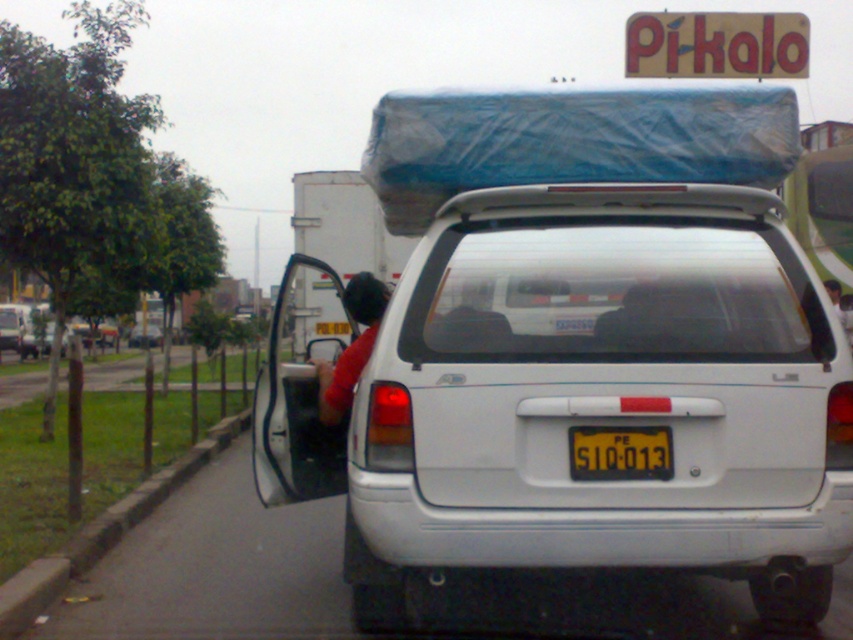
Does gray concrete curb at lower left have a lesser height compared to yellowtexturedlicense plate at center?

No, gray concrete curb at lower left is not shorter than yellowtexturedlicense plate at center.

Who is more distant from viewer, (50, 582) or (642, 428)?

Point (50, 582)

Locate an element on the screen. Image resolution: width=853 pixels, height=640 pixels. gray concrete curb at lower left is located at coordinates (103, 532).

Between gray concrete curb at lower left and white matte truck at center, which one has more height?

Standing taller between the two is white matte truck at center.

Does gray concrete curb at lower left have a smaller size compared to white matte truck at center?

Correct, gray concrete curb at lower left occupies less space than white matte truck at center.

The height and width of the screenshot is (640, 853). Identify the location of gray concrete curb at lower left. (103, 532).

Measure the distance between gray concrete curb at lower left and camera.

4.36 meters

Who is taller, gray concrete curb at lower left or white matte van at center?

Standing taller between the two is white matte van at center.

Describe the element at coordinates (103, 532) in the screenshot. I see `gray concrete curb at lower left` at that location.

Locate an element on the screen. gray concrete curb at lower left is located at coordinates (103, 532).